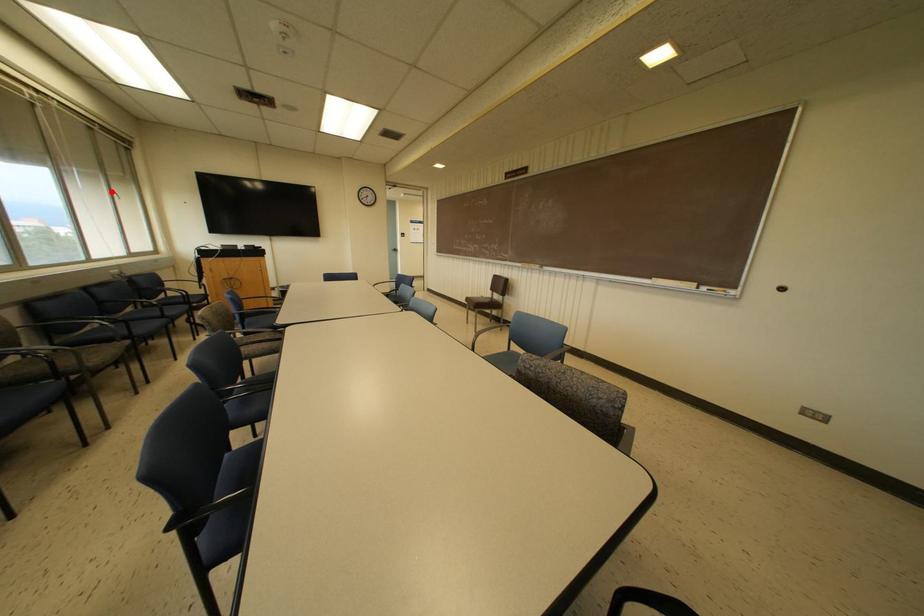
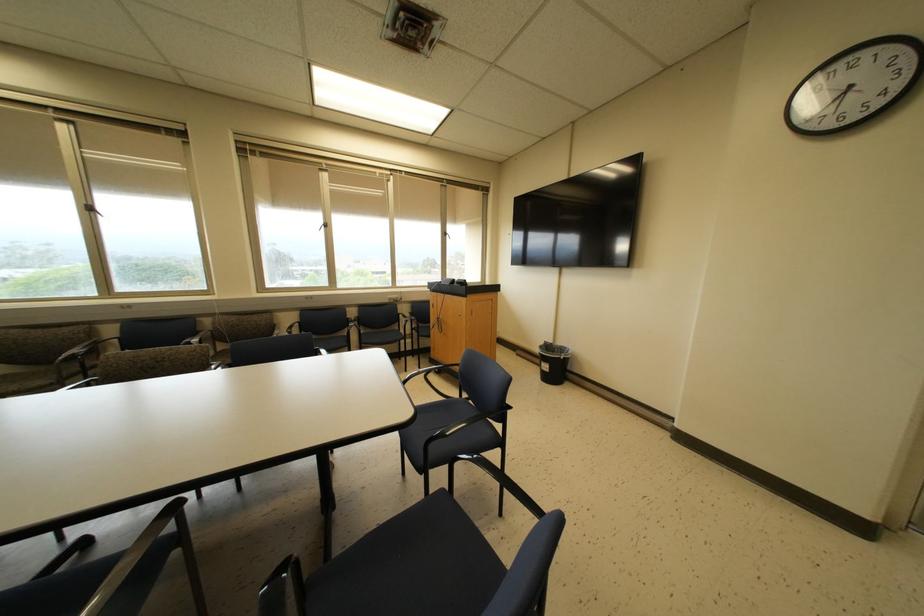
Where in the second image is the point corresponding to the highlighted location from the first image?

(444, 233)